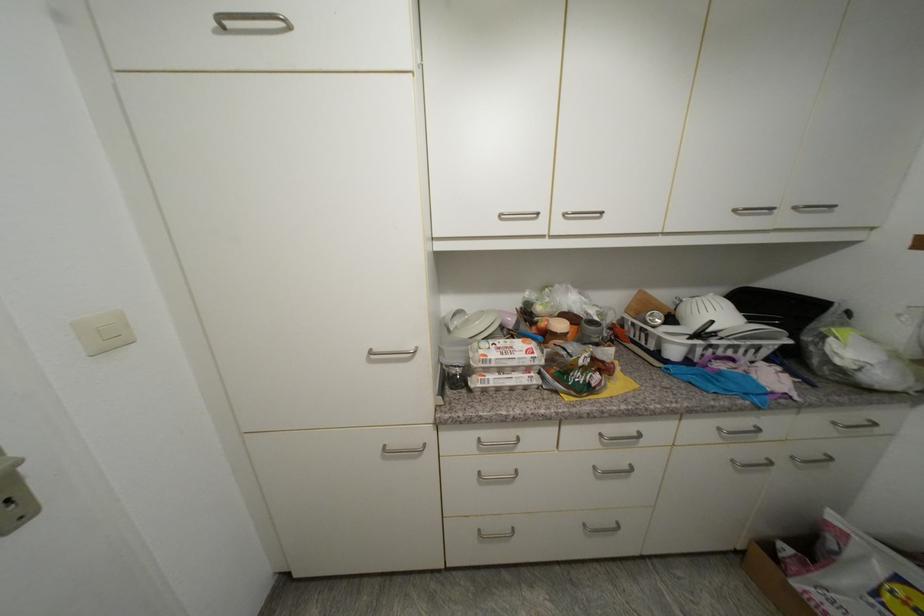
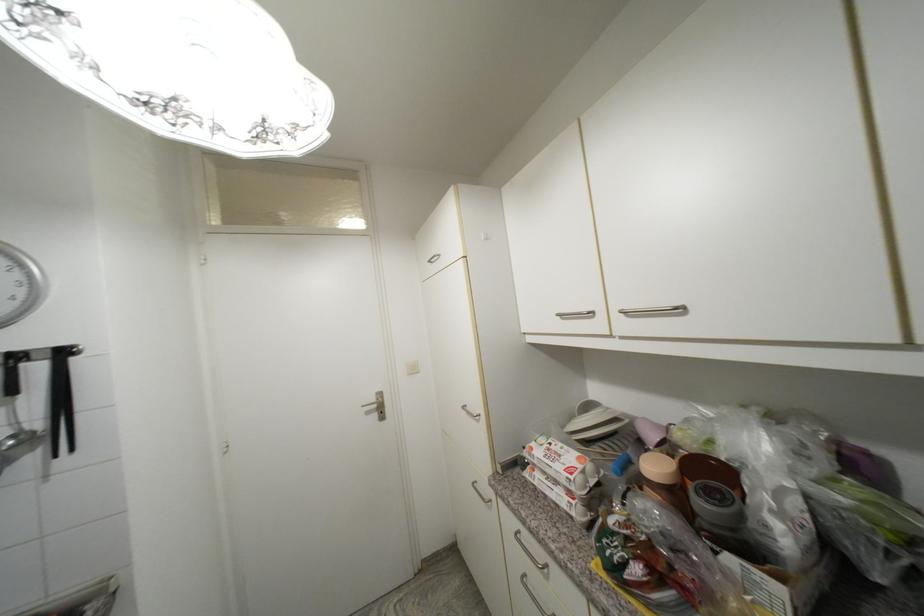
Locate, in the second image, the point that corresponds to (x=576, y=212) in the first image.

(631, 309)